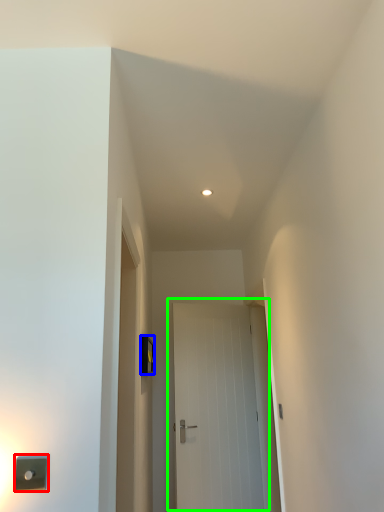
Question: Estimate the real-world distances between objects in this image. Which object is closer to light switch (highlighted by a red box), light switch (highlighted by a blue box) or door (highlighted by a green box)?

Choices:
 (A) light switch
 (B) door

Answer: (A)